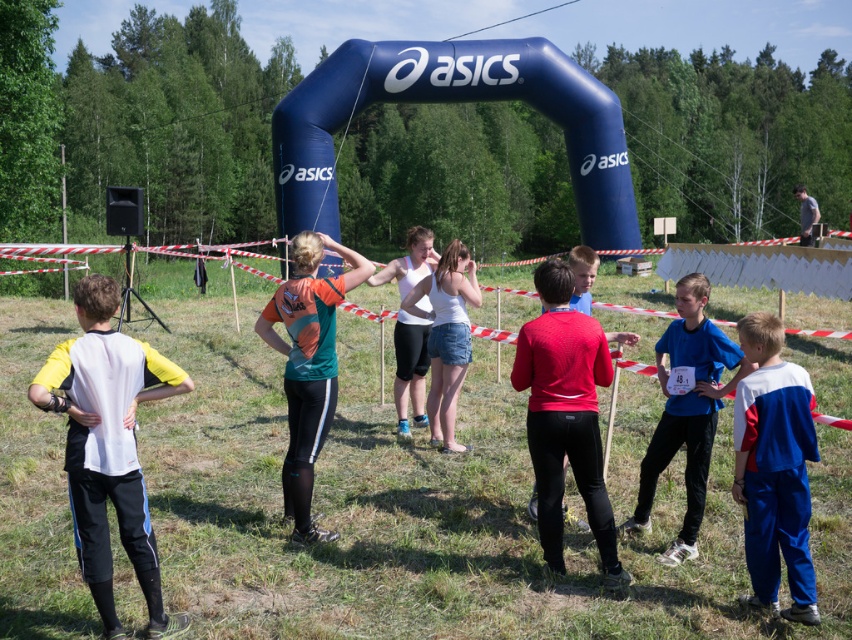
Is blue matte shirt at center thinner than white matte tank top at center?

Correct, blue matte shirt at center's width is less than white matte tank top at center's.

Does blue matte shirt at center have a smaller size compared to white matte tank top at center?

Yes.

Locate an element on the screen. blue matte shirt at center is located at coordinates click(x=686, y=410).

Is white matte shirt at left below blue matte shirt at center?

Correct, white matte shirt at left is located below blue matte shirt at center.

Can you confirm if white matte shirt at left is positioned to the right of blue matte shirt at center?

Incorrect, white matte shirt at left is not on the right side of blue matte shirt at center.

Who is more forward, (144, 520) or (659, 349)?

Positioned in front is point (144, 520).

At what (x,y) coordinates should I click in order to perform the action: click on white matte shirt at left. Please return your answer as a coordinate pair (x, y). Looking at the image, I should click on (108, 445).

Is matte red sweater at center shorter than white matte tank top at center?

Incorrect, matte red sweater at center's height does not fall short of white matte tank top at center's.

Describe the element at coordinates (565, 417) in the screenshot. I see `matte red sweater at center` at that location.

You are a GUI agent. You are given a task and a screenshot of the screen. Output one action in this format:
    pyautogui.click(x=<x>, y=<y>)
    Task: Click on the matte red sweater at center
    Image resolution: width=852 pixels, height=640 pixels.
    Given the screenshot: What is the action you would take?
    pyautogui.click(x=565, y=417)